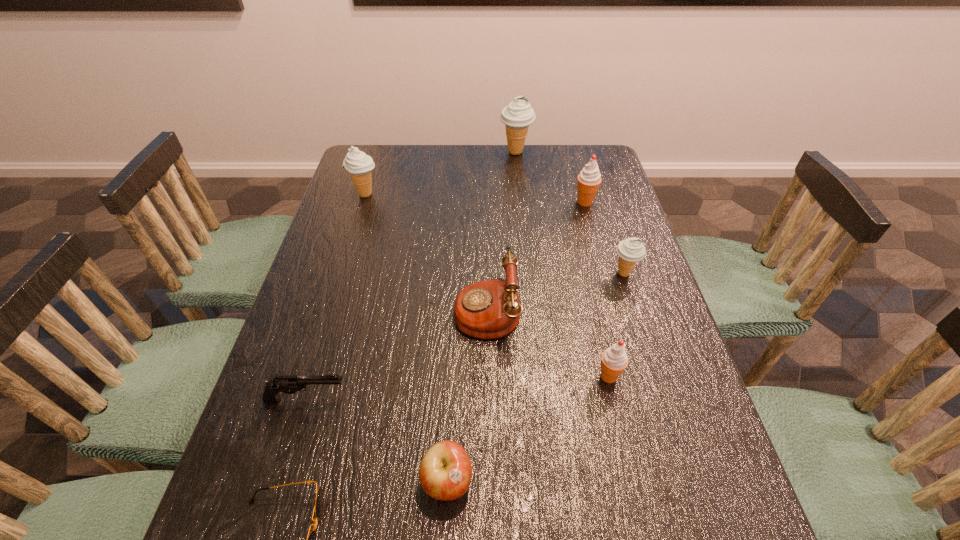
Locate an element on the screen. The width and height of the screenshot is (960, 540). black gun is located at coordinates (289, 384).

Where is `gun`? The height and width of the screenshot is (540, 960). gun is located at coordinates (289, 384).

You are a GUI agent. You are given a task and a screenshot of the screen. Output one action in this format:
    pyautogui.click(x=<x>, y=<y>)
    Task: Click on the apple
    The width and height of the screenshot is (960, 540).
    Given the screenshot: What is the action you would take?
    pyautogui.click(x=445, y=472)

Locate an element on the screen. The height and width of the screenshot is (540, 960). vacant space located on the right of the farthest object is located at coordinates (580, 152).

Identify the location of vacant space located on the right of the second biggest beige icecream. (505, 194).

Where is `vacant space situated on the left of the bigger red icecream`? This screenshot has width=960, height=540. vacant space situated on the left of the bigger red icecream is located at coordinates (484, 202).

The height and width of the screenshot is (540, 960). Identify the location of free location located on the dial of the telephone. (434, 308).

Identify the location of vacant space situated 0.260m on the dial of the telephone. [x=348, y=308].

Where is `vacant space situated on the dial of the telephone`? The width and height of the screenshot is (960, 540). vacant space situated on the dial of the telephone is located at coordinates (345, 308).

This screenshot has height=540, width=960. In order to click on free space located 0.230m on the left of the nearer red icecream in this screenshot , I will do `click(490, 376)`.